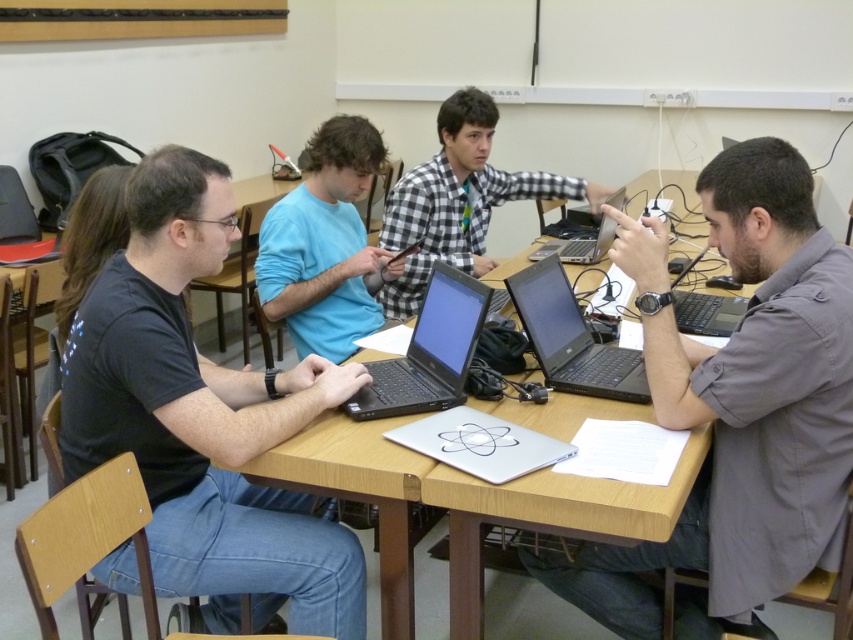
You are standing in front of the wooden table at center and want to place a 4.5 feet long object on it. Will the object fit on the table?

The wooden table at center is 4.43 feet from camera. The distance from the camera does not indicate the table length, so it is unclear if the object will fit.

You are a person sitting at the table and want to reach the satin black laptop at center without moving the matte blue shirt at center. Is this possible?

The satin black laptop at center is behind the matte blue shirt at center, so you cannot reach it without moving the shirt.

You are a person sitting at the table and want to reach the satin black laptop at center without moving the matte blue shirt at center. Is this possible?

The matte blue shirt at center is located above the satin black laptop at center, so you cannot reach the laptop without moving the shirt.